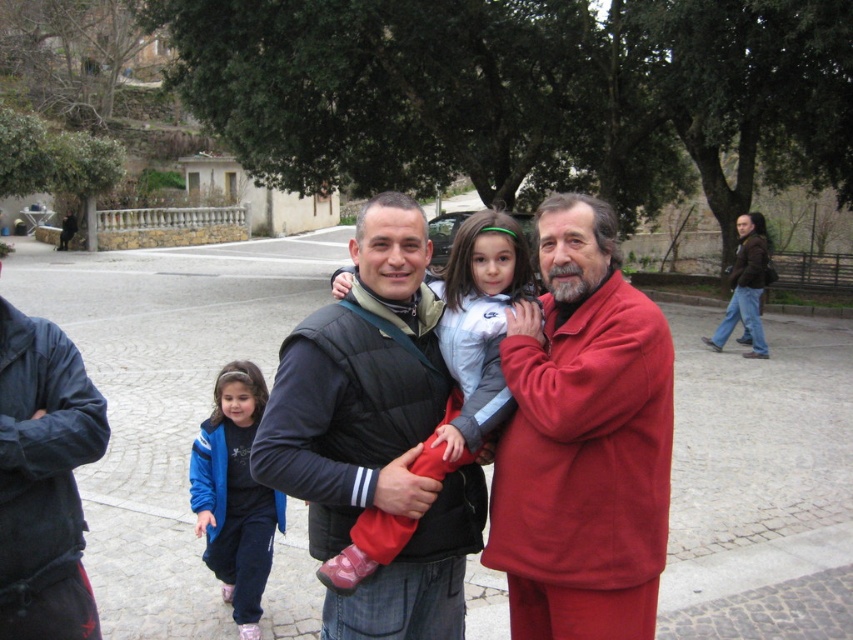
Is dark blue corduroy jacket at left positioned at the back of blue fleece jacket at lower left?

No, it is not.

Between point (10, 625) and point (247, 579), which one is positioned behind?

Positioned behind is point (247, 579).

The height and width of the screenshot is (640, 853). Find the location of `dark blue corduroy jacket at left`. dark blue corduroy jacket at left is located at coordinates (44, 480).

Between point (540, 396) and point (73, 433), which one is positioned in front?

Point (73, 433) is more forward.

Find the location of a particular element. matte red jacket at center is located at coordinates (582, 440).

Looking at this image, which of these two, black quilted vest at center or dark blue corduroy jacket at left, stands taller?

With more height is black quilted vest at center.

Who is positioned more to the left, black quilted vest at center or dark blue corduroy jacket at left?

Positioned to the left is dark blue corduroy jacket at left.

Between point (380, 600) and point (38, 480), which one is positioned behind?

The point (380, 600) is more distant.

Identify the location of black quilted vest at center. The width and height of the screenshot is (853, 640). (374, 435).